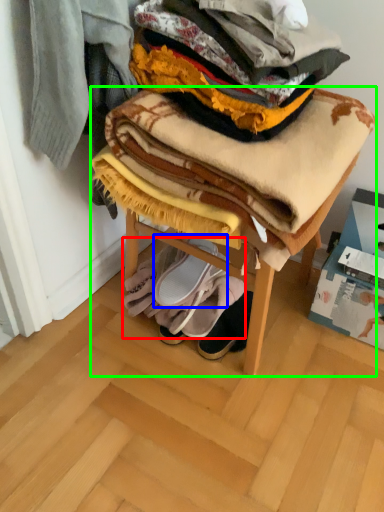
Question: Which is nearer to the blanket (highlighted by a red box)? footwear (highlighted by a blue box) or furniture (highlighted by a green box).

Choices:
 (A) footwear
 (B) furniture

Answer: (A)